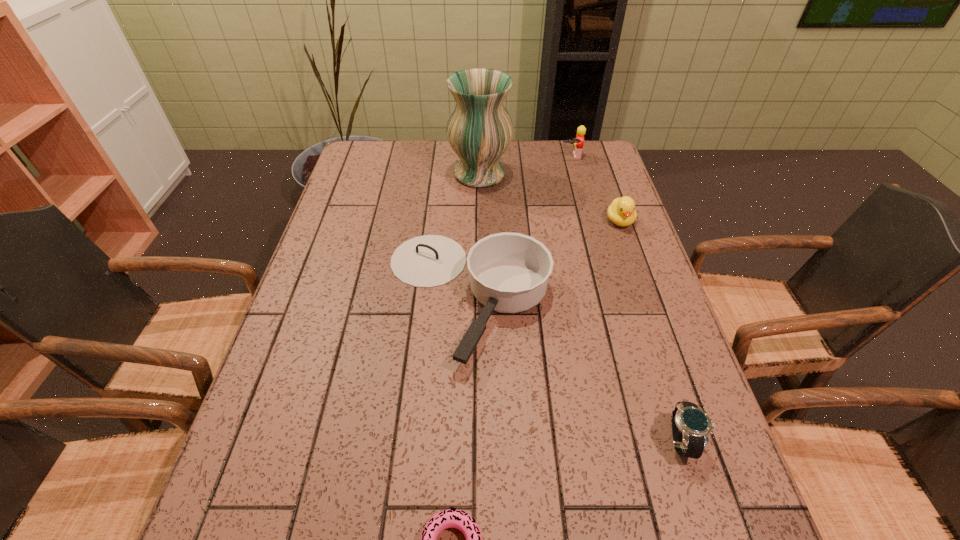
Where is `blank space at the near left corner of the desktop`? This screenshot has height=540, width=960. blank space at the near left corner of the desktop is located at coordinates (285, 528).

In the image, there is a desktop. Identify the location of blank space at the far right corner. Image resolution: width=960 pixels, height=540 pixels. (595, 140).

The height and width of the screenshot is (540, 960). In order to click on empty space between the second tallest object and the second nearest object in this screenshot , I will do `click(626, 299)`.

This screenshot has width=960, height=540. What are the coordinates of `vacant area that lies between the fifth shortest object and the watch` in the screenshot? It's located at (626, 299).

You are a GUI agent. You are given a task and a screenshot of the screen. Output one action in this format:
    pyautogui.click(x=<x>, y=<y>)
    Task: Click on the vacant area between the tallest object and the second tallest object
    
    Given the screenshot: What is the action you would take?
    pyautogui.click(x=525, y=165)

The width and height of the screenshot is (960, 540). In order to click on free space between the fourth farthest object and the fifth farthest object in this screenshot , I will do pyautogui.click(x=574, y=368).

The width and height of the screenshot is (960, 540). What are the coordinates of `vacant region between the third nearest object and the Lego` in the screenshot? It's located at (519, 226).

At what (x,y) coordinates should I click in order to perform the action: click on vacant space that's between the second nearest object and the vase. Please return your answer as a coordinate pair (x, y). Image resolution: width=960 pixels, height=540 pixels. Looking at the image, I should click on coord(581,307).

At what (x,y) coordinates should I click in order to perform the action: click on object that is the fourth closest to the doughnut. Please return your answer as a coordinate pair (x, y). This screenshot has height=540, width=960. Looking at the image, I should click on (479, 129).

Identify which object is the third nearest to the fifth farthest object. Please provide its 2D coordinates. Your answer should be formatted as a tuple, i.e. [(x, y)], where the tuple contains the x and y coordinates of a point satisfying the conditions above.

[(621, 212)]